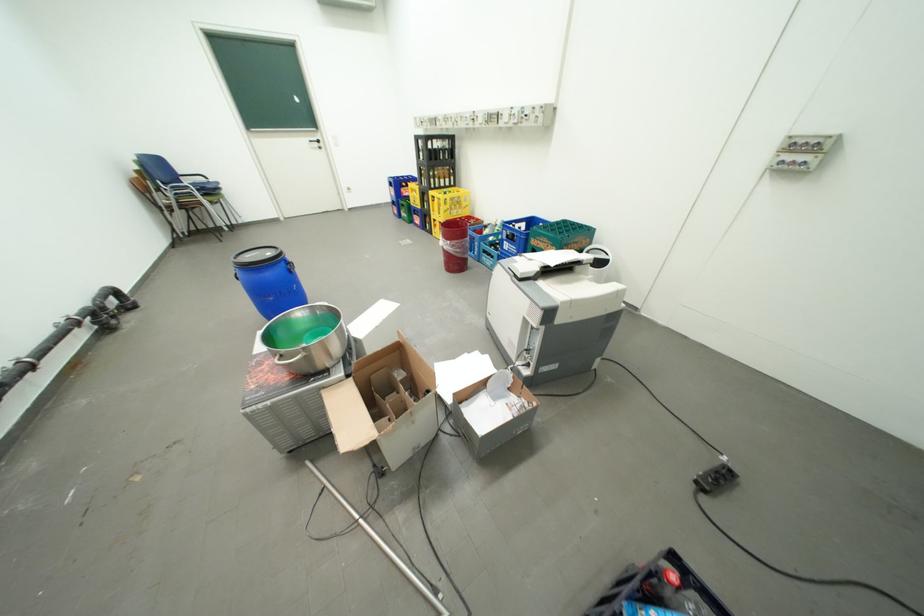
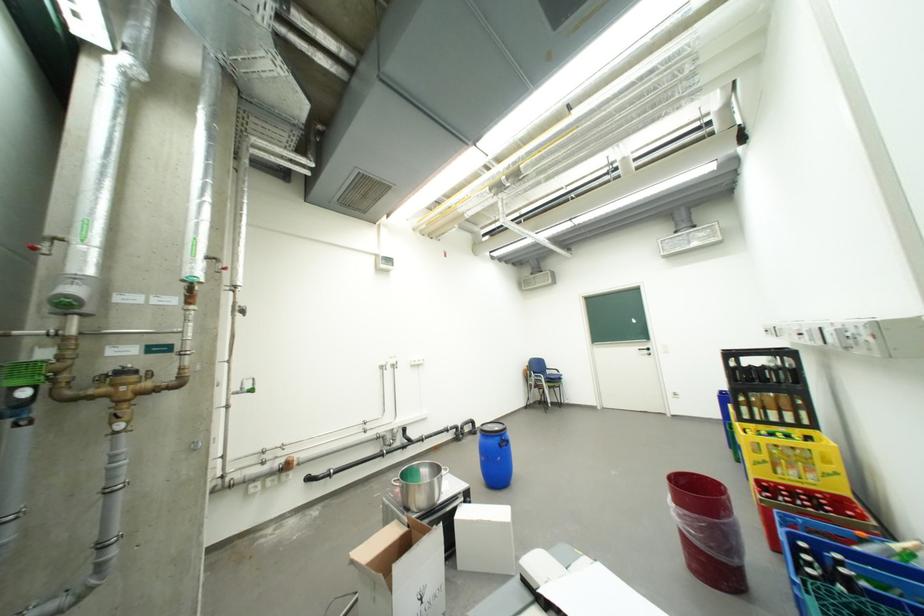
Find the pixel in the second image that matches (x=459, y=243) in the first image.

(685, 507)